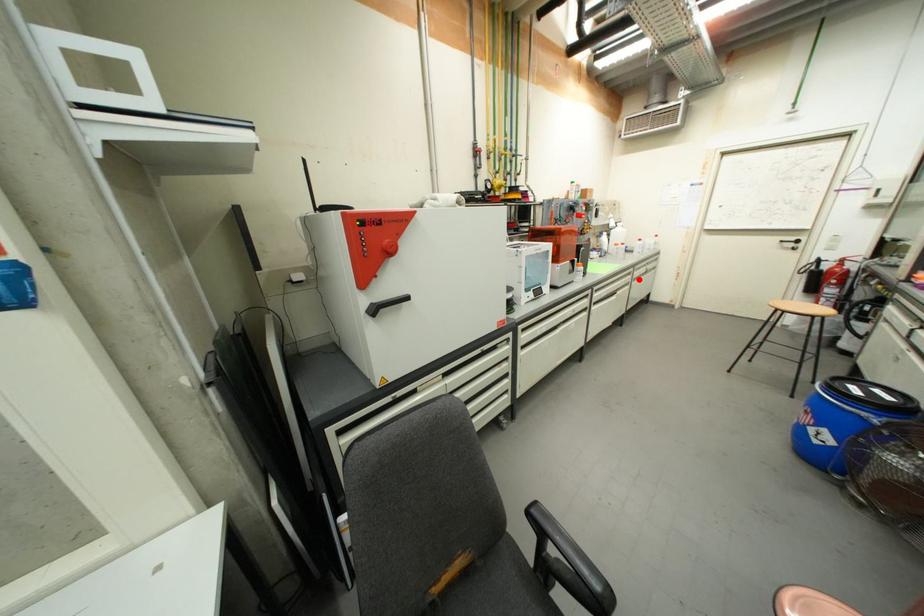
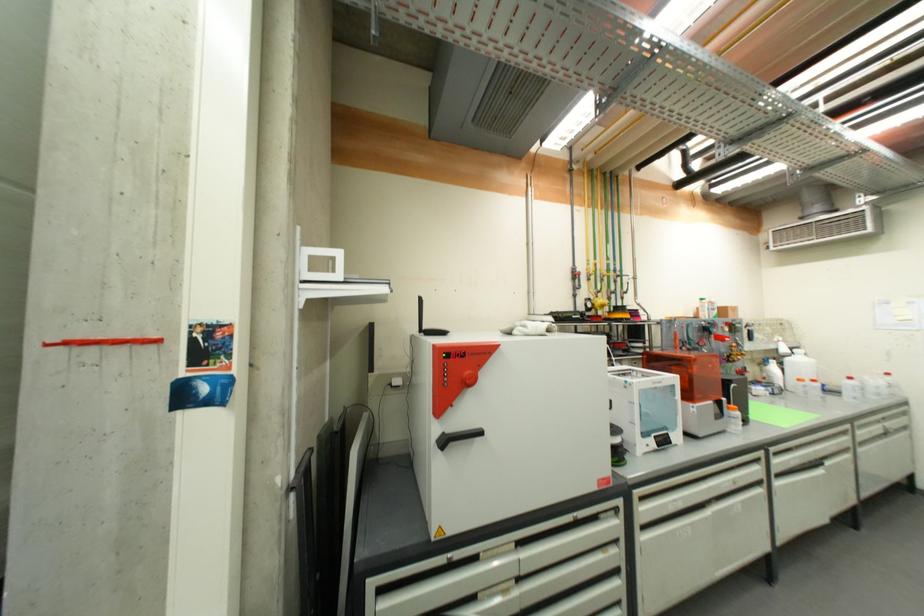
The point at the highlighted location is marked in the first image. Where is the corresponding point in the second image?

(864, 442)